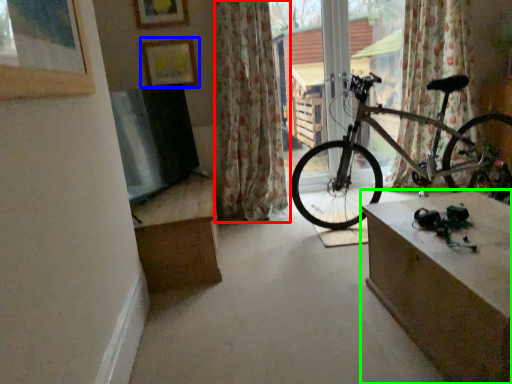
Question: Which object is the closest to the curtain (highlighted by a red box)? Choose among these: picture frame (highlighted by a blue box) or table (highlighted by a green box).

Choices:
 (A) picture frame
 (B) table

Answer: (A)